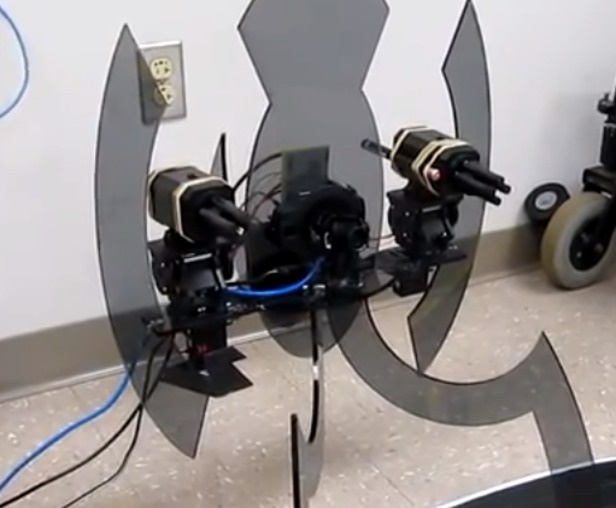
Locate an element on the screen. empty space on wall above the wheel is located at coordinates (549, 163).